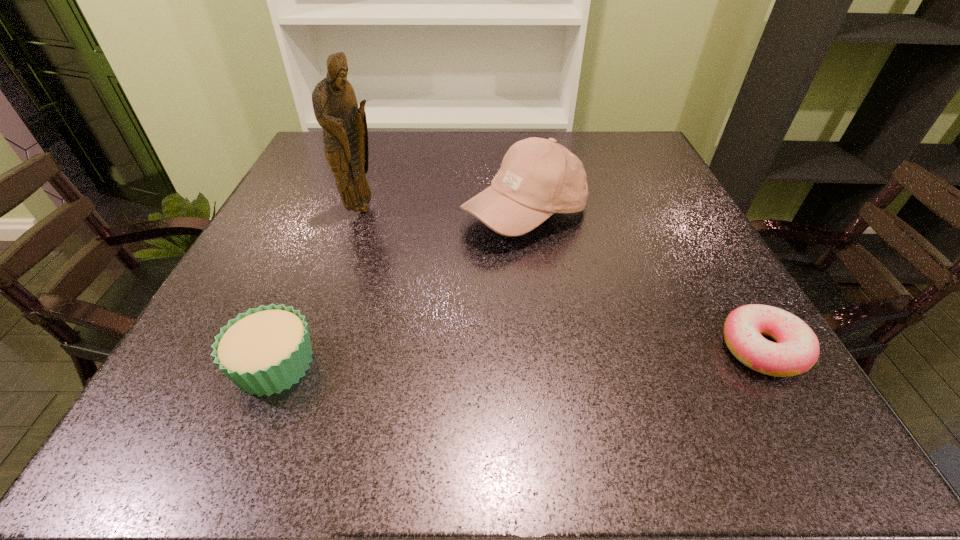
I want to click on vacant point located between the cupcake and the baseball cap, so click(399, 289).

Find the location of a particular element. blank region between the cupcake and the rightmost object is located at coordinates (518, 356).

Identify the location of empty space that is in between the third tallest object and the second tallest object. The width and height of the screenshot is (960, 540). (399, 289).

This screenshot has height=540, width=960. Find the location of `unoccupied area between the cupcake and the shortest object`. unoccupied area between the cupcake and the shortest object is located at coordinates (518, 356).

Where is `vacant area that lies between the third tallest object and the baseball cap`? The height and width of the screenshot is (540, 960). vacant area that lies between the third tallest object and the baseball cap is located at coordinates (399, 289).

Identify the location of vacant area that lies between the rightmost object and the second shortest object. The image size is (960, 540). (518, 356).

The width and height of the screenshot is (960, 540). What are the coordinates of `vacant area between the tallest object and the second shortest object` in the screenshot? It's located at (319, 287).

Point out which object is positioned as the second nearest to the doughnut. Please provide its 2D coordinates. Your answer should be formatted as a tuple, i.e. [(x, y)], where the tuple contains the x and y coordinates of a point satisfying the conditions above.

[(265, 350)]

Select which object is the third closest to the baseball cap. Please provide its 2D coordinates. Your answer should be formatted as a tuple, i.e. [(x, y)], where the tuple contains the x and y coordinates of a point satisfying the conditions above.

[(265, 350)]

This screenshot has width=960, height=540. Find the location of `free space that satisfies the following two spatial constraints: 1. on the front side of the rightmost object; 2. on the right side of the second tallest object`. free space that satisfies the following two spatial constraints: 1. on the front side of the rightmost object; 2. on the right side of the second tallest object is located at coordinates (542, 348).